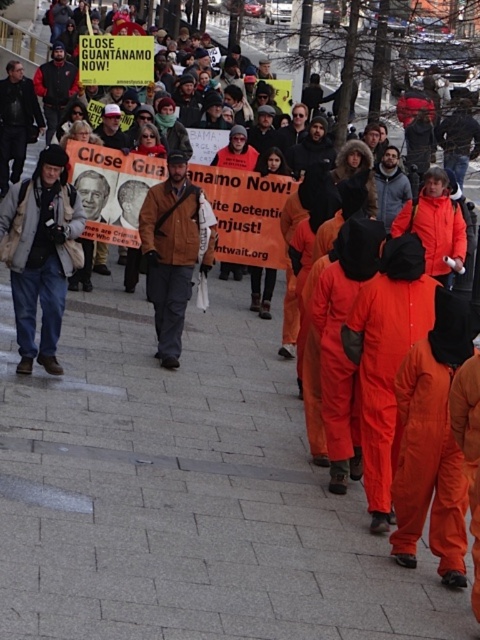
Which of these two, brown leather jacket at center or matte black jacket at left, stands shorter?

matte black jacket at left

Which is above, brown leather jacket at center or matte black jacket at left?

matte black jacket at left is above.

Locate an element on the screen. brown leather jacket at center is located at coordinates (175, 252).

Is matte beige jacket at center shorter than matte black jacket at left?

In fact, matte beige jacket at center may be taller than matte black jacket at left.

Based on the photo, is the position of matte beige jacket at center less distant than that of matte black jacket at left?

Yes, matte beige jacket at center is in front of matte black jacket at left.

At what (x,y) coordinates should I click in order to perform the action: click on matte beige jacket at center. Please return your answer as a coordinate pair (x, y). The width and height of the screenshot is (480, 640). Looking at the image, I should click on (40, 253).

Is the position of matte beige jacket at center less distant than that of brown leather jacket at center?

Yes, matte beige jacket at center is in front of brown leather jacket at center.

Is matte beige jacket at center to the left of brown leather jacket at center from the viewer's perspective?

Yes, matte beige jacket at center is to the left of brown leather jacket at center.

Does point (78, 246) come in front of point (156, 188)?

Yes, it is.

This screenshot has height=640, width=480. I want to click on matte beige jacket at center, so click(40, 253).